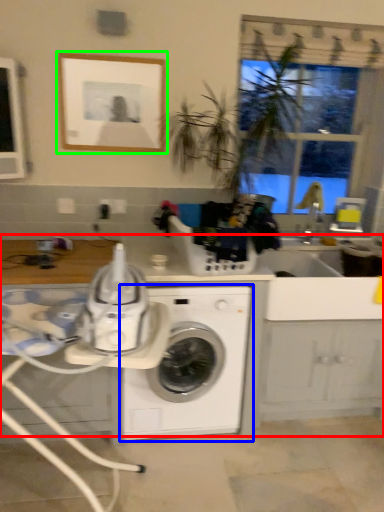
Question: Based on their relative distances, which object is farther from counter top (highlighted by a red box)? Choose from washing machine (highlighted by a blue box) and picture frame (highlighted by a green box).

Choices:
 (A) washing machine
 (B) picture frame

Answer: (B)